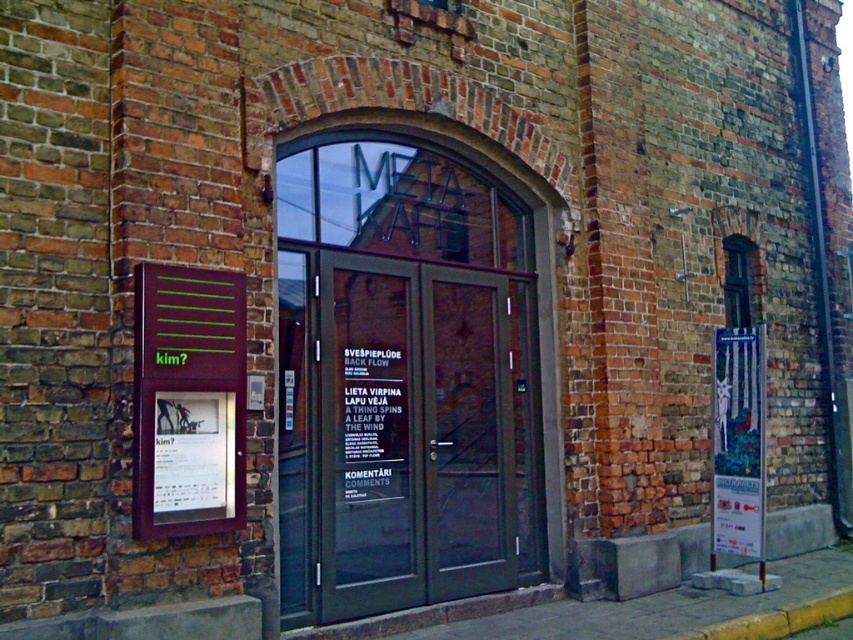
Question: Which object is closer to the camera taking this photo?

Choices:
 (A) green glass doors at center
 (B) metallic poster at right
 (C) green glass door at center

Answer: (A)

Question: Based on their relative distances, which object is nearer to the green glass doors at center?

Choices:
 (A) green glass door at center
 (B) matte purple signboard at left
 (C) metallic poster at right

Answer: (A)

Question: Is matte purple signboard at left to the right of metallic poster at right from the viewer's perspective?

Choices:
 (A) no
 (B) yes

Answer: (A)

Question: Considering the real-world distances, which object is farthest from the green glass doors at center?

Choices:
 (A) matte purple signboard at left
 (B) metallic poster at right
 (C) green glass door at center

Answer: (B)

Question: Does green glass door at center have a lesser width compared to matte purple signboard at left?

Choices:
 (A) no
 (B) yes

Answer: (A)

Question: Does green glass door at center appear under matte purple signboard at left?

Choices:
 (A) no
 (B) yes

Answer: (B)